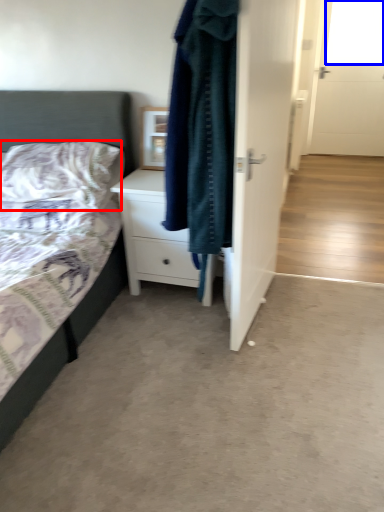
Question: Which object is further to the camera taking this photo, pillow (highlighted by a red box) or window screen (highlighted by a blue box)?

Choices:
 (A) pillow
 (B) window screen

Answer: (B)